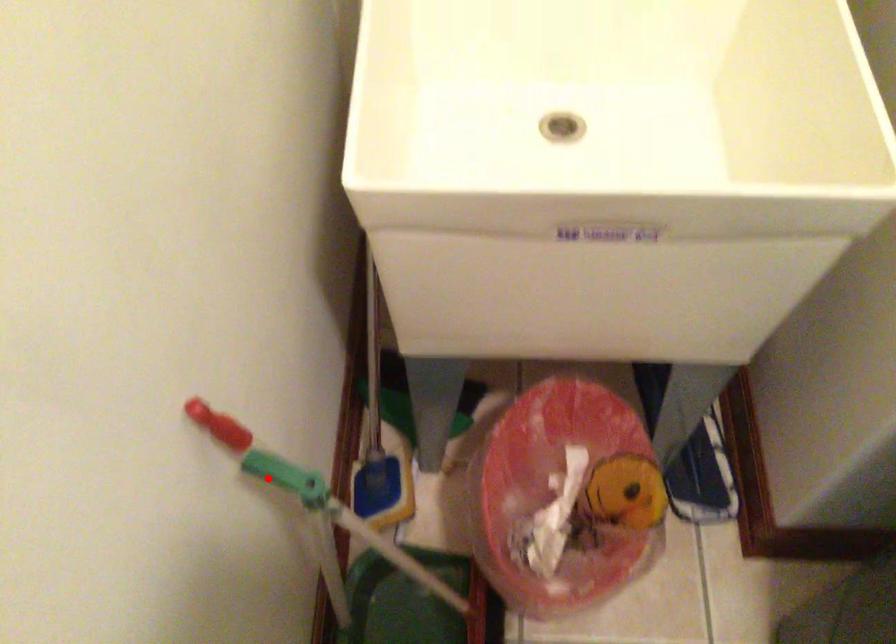
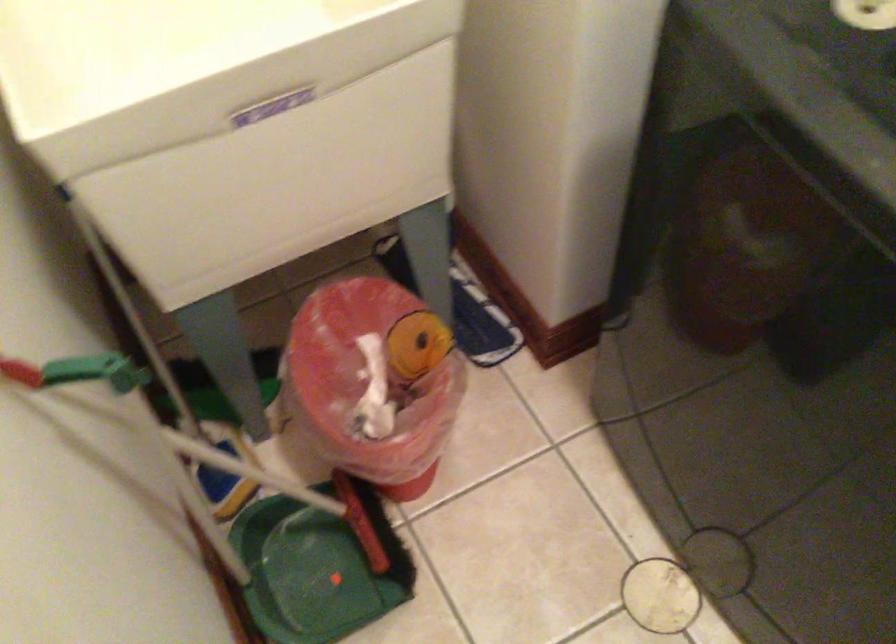
The point at the highlighted location is marked in the first image. Where is the corresponding point in the second image?

(90, 415)